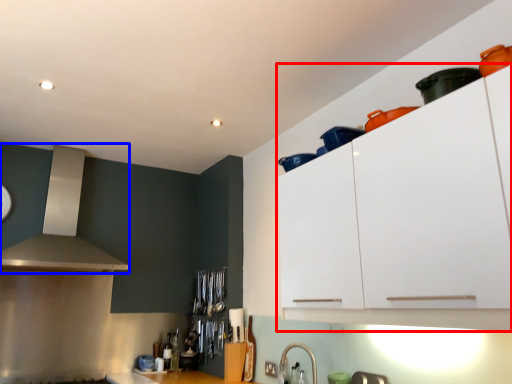
Question: Which point is further to the camera, cabinetry (highlighted by a red box) or vent (highlighted by a blue box)?

Choices:
 (A) cabinetry
 (B) vent

Answer: (B)